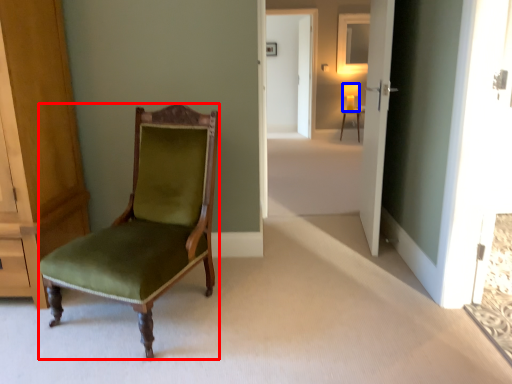
Question: Which point is closer to the camera, chair (highlighted by a red box) or lamp (highlighted by a blue box)?

Choices:
 (A) chair
 (B) lamp

Answer: (A)